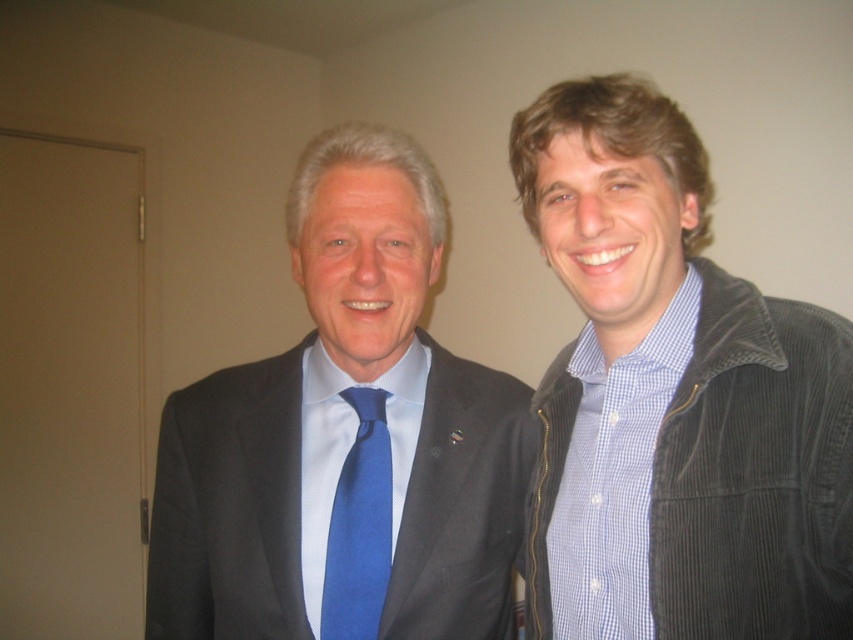
Who is positioned more to the left, corduroy jacket at right or matte black suit at left?

Positioned to the left is matte black suit at left.

What do you see at coordinates (676, 394) in the screenshot? The width and height of the screenshot is (853, 640). I see `corduroy jacket at right` at bounding box center [676, 394].

The image size is (853, 640). What do you see at coordinates (676, 394) in the screenshot?
I see `corduroy jacket at right` at bounding box center [676, 394].

Where is `corduroy jacket at right`? The width and height of the screenshot is (853, 640). corduroy jacket at right is located at coordinates (676, 394).

Does corduroy jacket at right appear on the right side of blue silk tie at center?

Yes, corduroy jacket at right is to the right of blue silk tie at center.

Locate an element on the screen. The height and width of the screenshot is (640, 853). corduroy jacket at right is located at coordinates coord(676,394).

Is matte black suit at left bigger than blue silk tie at center?

Yes.

Between matte black suit at left and blue silk tie at center, which one is positioned lower?

blue silk tie at center is lower down.

Consider the image. Who is more forward, (341, 204) or (358, 515)?

Point (341, 204)

Where is `matte black suit at left`? matte black suit at left is located at coordinates coord(345,440).